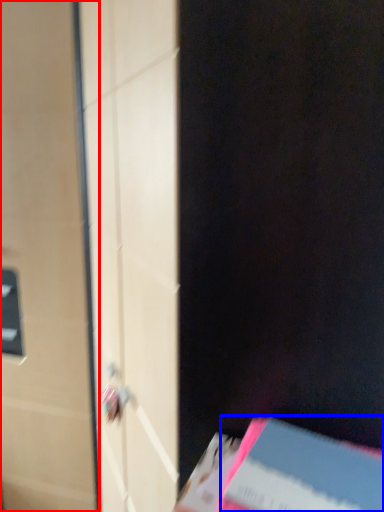
Question: Which point is further to the camera, door (highlighted by a red box) or paperback book (highlighted by a blue box)?

Choices:
 (A) door
 (B) paperback book

Answer: (A)